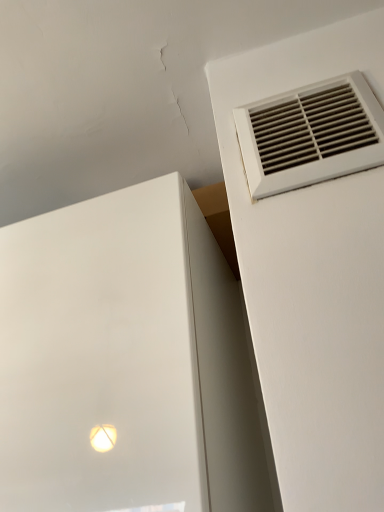
Measure the distance between point (282, 173) and camera.

The depth of point (282, 173) is 19.06 inches.

I want to click on white plastic air conditioning at upper right, so click(311, 136).

What do you see at coordinates (311, 136) in the screenshot? I see `white plastic air conditioning at upper right` at bounding box center [311, 136].

Find the location of `white plastic air conditioning at upper right`. white plastic air conditioning at upper right is located at coordinates (311, 136).